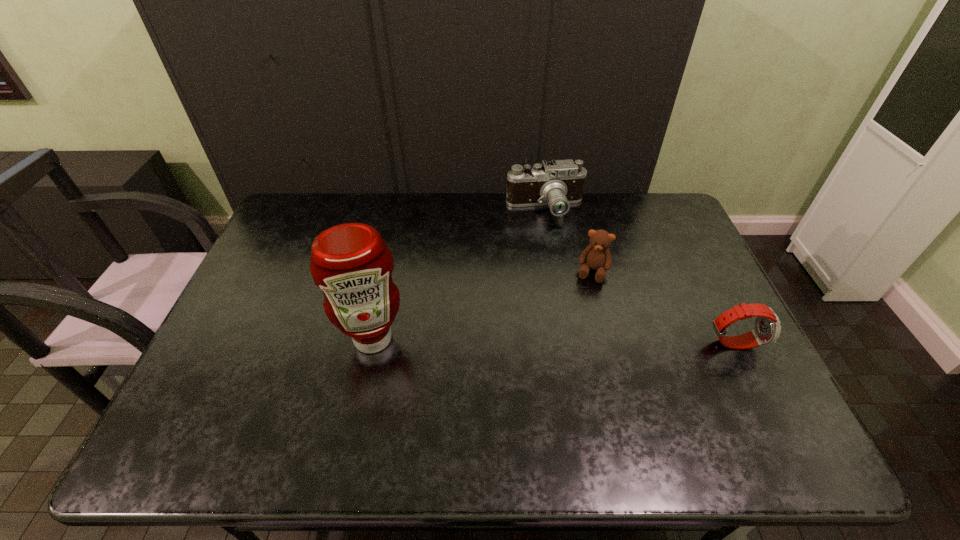
Find the location of a particular element. The width and height of the screenshot is (960, 540). object that is the nearest to the watch is located at coordinates (596, 256).

This screenshot has width=960, height=540. In order to click on object that is the second closest to the leftmost object in this screenshot , I will do `click(558, 183)`.

Locate an element on the screen. This screenshot has width=960, height=540. free space that satisfies the following two spatial constraints: 1. on the front side of the farthest object; 2. on the face of the rightmost object is located at coordinates (569, 342).

Find the location of `free location that satisfies the following two spatial constraints: 1. on the front side of the rightmost object; 2. on the face of the teddy bear`. free location that satisfies the following two spatial constraints: 1. on the front side of the rightmost object; 2. on the face of the teddy bear is located at coordinates (611, 342).

At what (x,y) coordinates should I click in order to perform the action: click on vacant region that satisfies the following two spatial constraints: 1. on the front side of the teddy bear; 2. on the face of the watch. Please return your answer as a coordinate pair (x, y). Looking at the image, I should click on (611, 342).

Locate an element on the screen. free location that satisfies the following two spatial constraints: 1. on the front side of the leftmost object; 2. on the face of the watch is located at coordinates (372, 342).

This screenshot has width=960, height=540. Identify the location of vacant region that satisfies the following two spatial constraints: 1. on the front side of the second farthest object; 2. on the right side of the camera. (557, 272).

Image resolution: width=960 pixels, height=540 pixels. Identify the location of vacant space that satisfies the following two spatial constraints: 1. on the front side of the farthest object; 2. on the face of the watch. (569, 342).